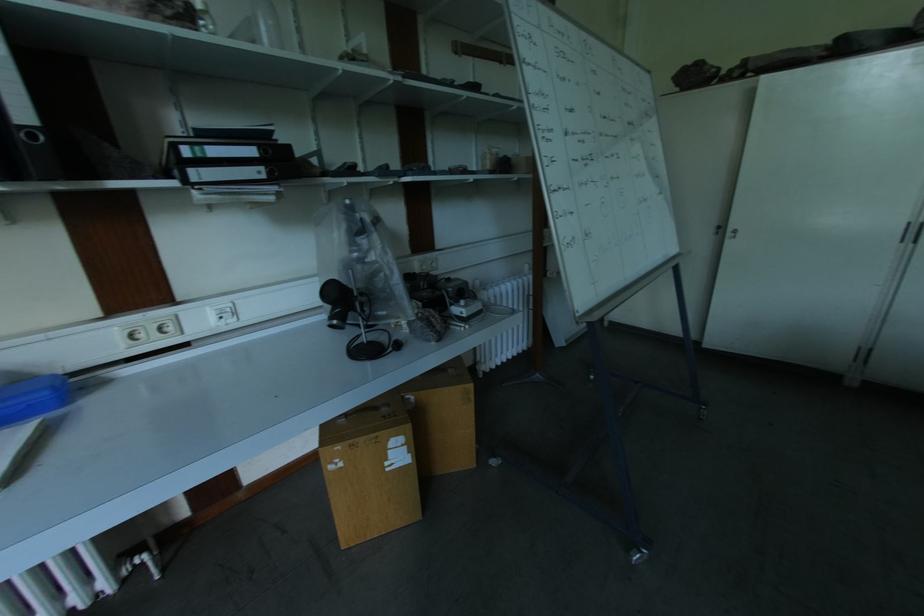
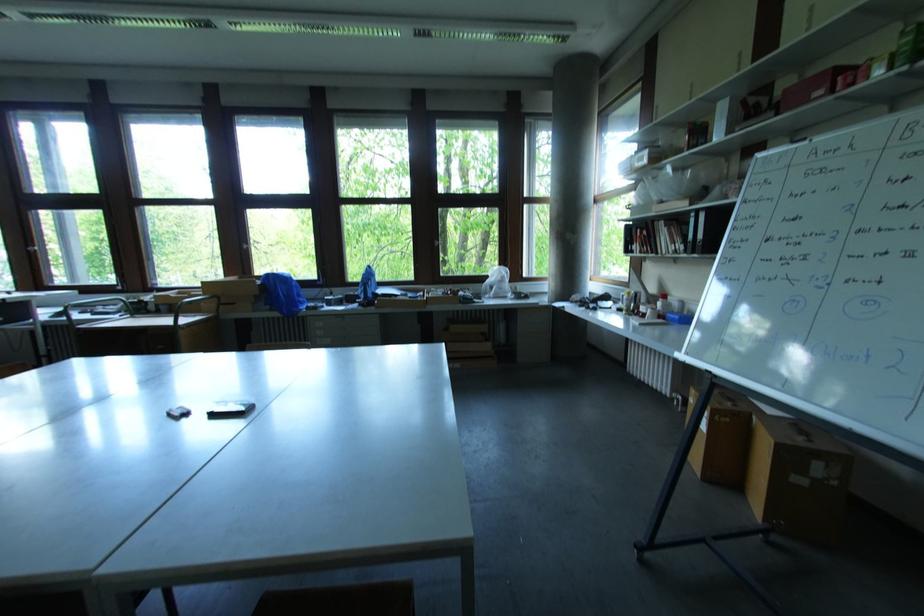
In the second image, find the point that corresponds to point 406,447 in the first image.

(709, 419)